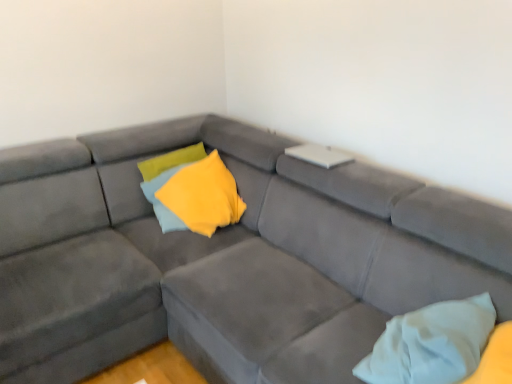
Question: Is yellow soft fabric pillow at center, the first pillow when ordered from top to bottom, aimed at white soft pillow at lower right, arranged as the 1th pillow when viewed from the right?

Choices:
 (A) yes
 (B) no

Answer: (A)

Question: Considering the relative positions of yellow soft fabric pillow at center, which is the 2th pillow in front-to-back order, and white soft pillow at lower right, acting as the second pillow starting from the top, in the image provided, is yellow soft fabric pillow at center, which is the 2th pillow in front-to-back order, to the left of white soft pillow at lower right, acting as the second pillow starting from the top, from the viewer's perspective?

Choices:
 (A) yes
 (B) no

Answer: (A)

Question: Is white soft pillow at lower right, the 2th pillow viewed from the back, at the back of yellow soft fabric pillow at center, positioned as the second pillow in bottom-to-top order?

Choices:
 (A) yes
 (B) no

Answer: (B)

Question: Can you confirm if yellow soft fabric pillow at center, the first pillow when ordered from top to bottom, is taller than white soft pillow at lower right, which is the first pillow from front to back?

Choices:
 (A) no
 (B) yes

Answer: (B)

Question: Does yellow soft fabric pillow at center, the first pillow when ordered from top to bottom, lie behind white soft pillow at lower right, acting as the second pillow starting from the top?

Choices:
 (A) no
 (B) yes

Answer: (B)

Question: Is white soft pillow at lower right, the first pillow from the bottom, inside or outside of yellow soft fabric pillow at center, which appears as the second pillow when viewed from the right?

Choices:
 (A) outside
 (B) inside

Answer: (A)

Question: In terms of size, does white soft pillow at lower right, the 2th pillow viewed from the back, appear bigger or smaller than yellow soft fabric pillow at center, the first pillow from the left?

Choices:
 (A) big
 (B) small

Answer: (B)

Question: From the image's perspective, is white soft pillow at lower right, acting as the second pillow starting from the top, positioned above or below yellow soft fabric pillow at center, the first pillow when ordered from top to bottom?

Choices:
 (A) above
 (B) below

Answer: (B)

Question: Does point (435, 337) appear closer or farther from the camera than point (208, 220)?

Choices:
 (A) closer
 (B) farther

Answer: (A)

Question: Is point (147, 304) closer or farther from the camera than point (460, 322)?

Choices:
 (A) farther
 (B) closer

Answer: (A)

Question: From the image's perspective, relative to white soft pillow at lower right, acting as the second pillow starting from the top, is suede gray couch at center above or below?

Choices:
 (A) below
 (B) above

Answer: (B)

Question: Is suede gray couch at center inside the boundaries of white soft pillow at lower right, the first pillow from the bottom, or outside?

Choices:
 (A) outside
 (B) inside

Answer: (A)

Question: From a real-world perspective, is suede gray couch at center physically located above or below white soft pillow at lower right, the 2th pillow viewed from the back?

Choices:
 (A) above
 (B) below

Answer: (B)

Question: Is white soft pillow at lower right, acting as the second pillow starting from the top, situated inside suede gray couch at center or outside?

Choices:
 (A) inside
 (B) outside

Answer: (A)

Question: Considering the positions of point (472, 344) and point (115, 205), is point (472, 344) closer or farther from the camera than point (115, 205)?

Choices:
 (A) closer
 (B) farther

Answer: (A)